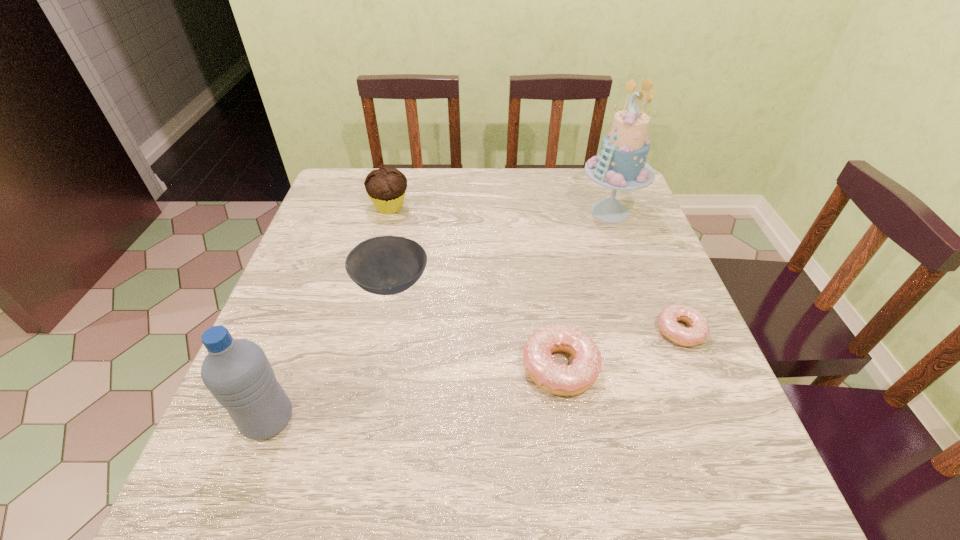
Given the evenly spaced doughnuts in the image, where should an extra doughnut be added on the left to preserve the spacing? Please point to a vacant space. Please provide its 2D coordinates. Your answer should be formatted as a tuple, i.e. [(x, y)], where the tuple contains the x and y coordinates of a point satisfying the conditions above.

[(419, 410)]